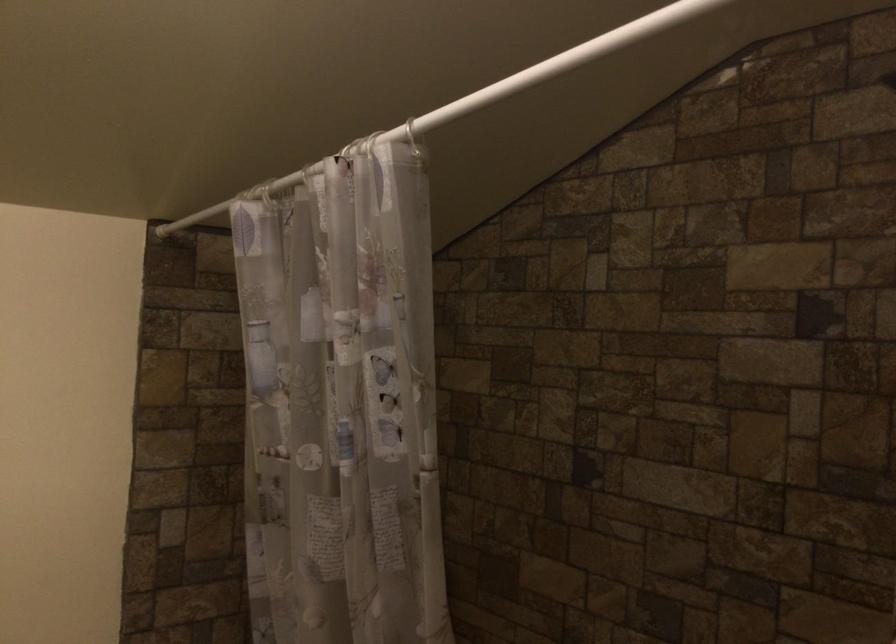
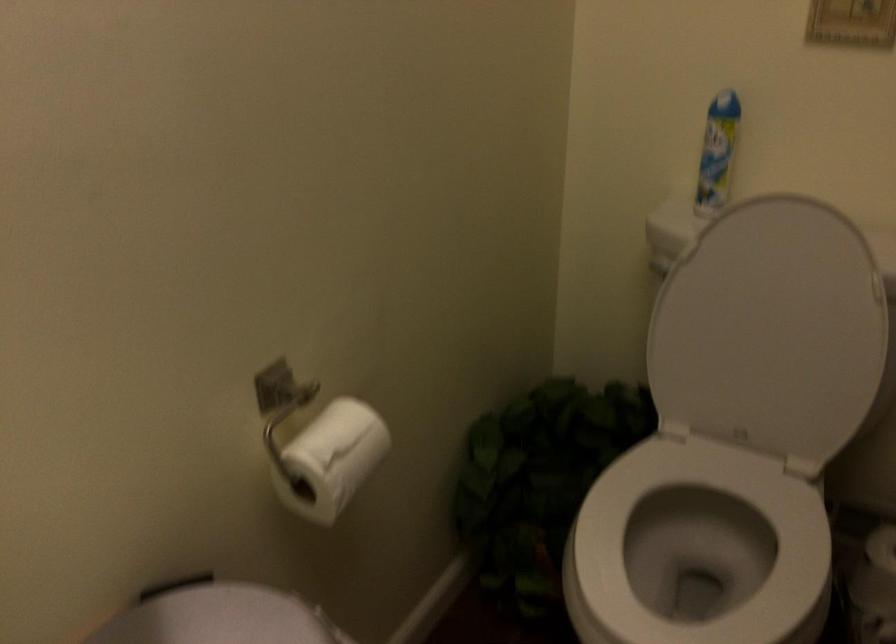
The images are taken continuously from a first-person perspective. In which direction is your viewpoint rotating?

The camera rotated toward left-down.